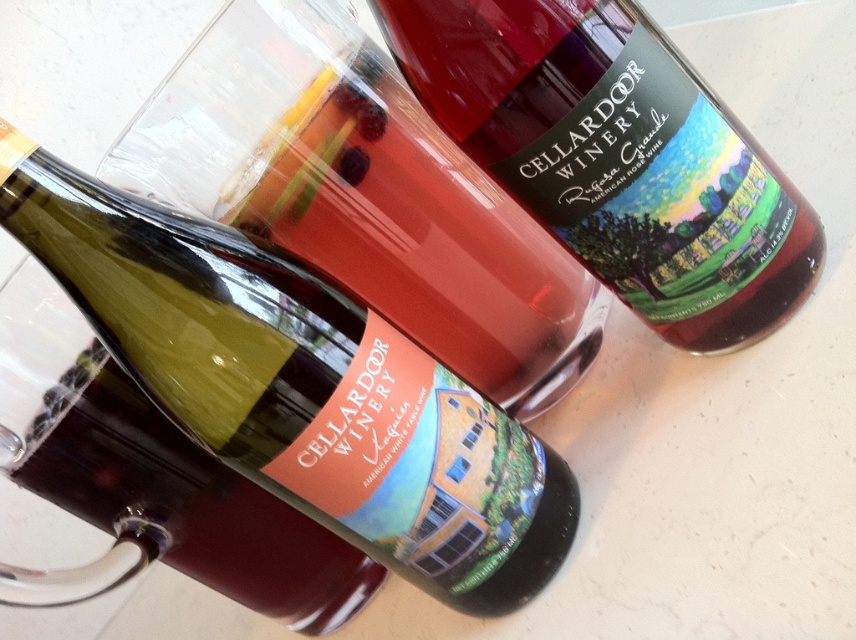
Question: Which of the following is the closest to the observer?

Choices:
 (A) (704, 236)
 (B) (492, 579)

Answer: (A)

Question: Does matte glass bottle at center have a larger size compared to translucent glass bottle at upper right?

Choices:
 (A) no
 (B) yes

Answer: (B)

Question: Considering the relative positions of matte glass bottle at center and translucent glass bottle at upper right in the image provided, where is matte glass bottle at center located with respect to translucent glass bottle at upper right?

Choices:
 (A) right
 (B) left

Answer: (B)

Question: Which of the following is the farthest from the observer?

Choices:
 (A) (492, 68)
 (B) (195, 412)

Answer: (B)

Question: Considering the relative positions of matte glass bottle at center and translucent glass bottle at upper right in the image provided, where is matte glass bottle at center located with respect to translucent glass bottle at upper right?

Choices:
 (A) left
 (B) right

Answer: (A)

Question: Which object is farther from the camera taking this photo?

Choices:
 (A) translucent glass bottle at upper right
 (B) matte glass bottle at center

Answer: (A)